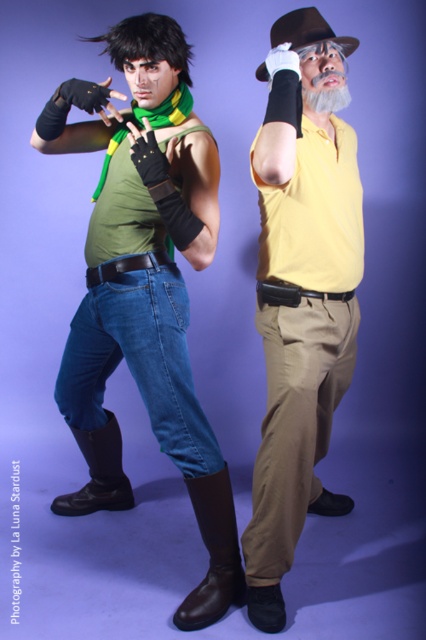
Question: Among these objects, which one is nearest to the camera?

Choices:
 (A) matte yellow shirt at center
 (B) matte green tank top at left

Answer: (A)

Question: Among these objects, which one is nearest to the camera?

Choices:
 (A) matte green tank top at left
 (B) matte yellow shirt at center

Answer: (B)

Question: Does matte green tank top at left appear over matte yellow shirt at center?

Choices:
 (A) no
 (B) yes

Answer: (B)

Question: Where is matte green tank top at left located in relation to matte yellow shirt at center in the image?

Choices:
 (A) left
 (B) right

Answer: (A)

Question: Which point is closer to the camera taking this photo?

Choices:
 (A) (98, 493)
 (B) (336, 198)

Answer: (B)

Question: Can you confirm if matte green tank top at left is thinner than matte yellow shirt at center?

Choices:
 (A) yes
 (B) no

Answer: (B)